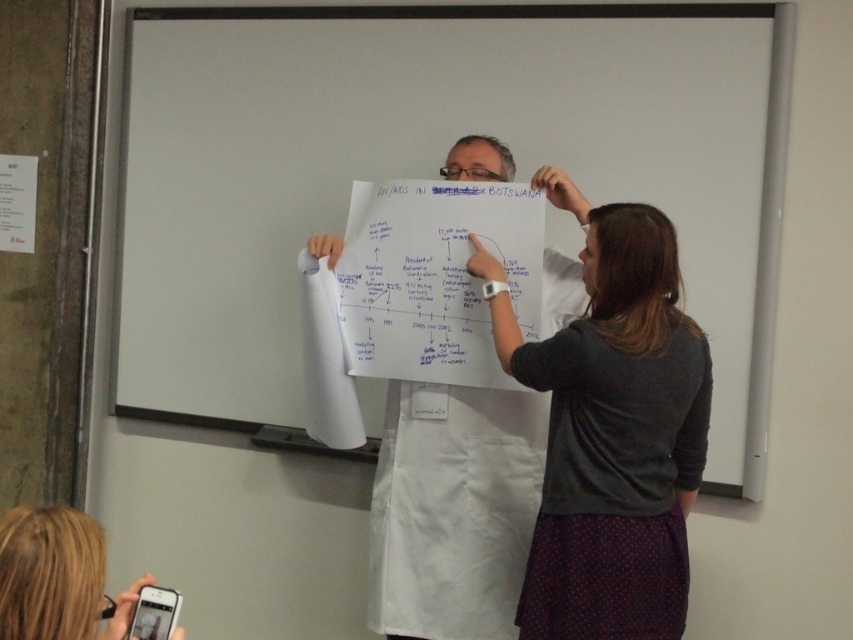
Question: Which object is positioned farthest from the whiteboard at center?

Choices:
 (A) dark gray shirt at center
 (B) blonde hair at lower left
 (C) white paper at center

Answer: (B)

Question: Considering the relative positions of whiteboard at center and white paper at center in the image provided, where is whiteboard at center located with respect to white paper at center?

Choices:
 (A) below
 (B) above

Answer: (B)

Question: Which point is closer to the camera?

Choices:
 (A) blonde hair at lower left
 (B) white paper at center
 (C) whiteboard at center
 (D) dark gray shirt at center

Answer: (A)

Question: Among these objects, which one is farthest from the camera?

Choices:
 (A) dark gray shirt at center
 (B) blonde hair at lower left

Answer: (A)

Question: Does dark gray shirt at center have a smaller size compared to blonde hair at lower left?

Choices:
 (A) yes
 (B) no

Answer: (B)

Question: Is whiteboard at center in front of blonde hair at lower left?

Choices:
 (A) yes
 (B) no

Answer: (B)